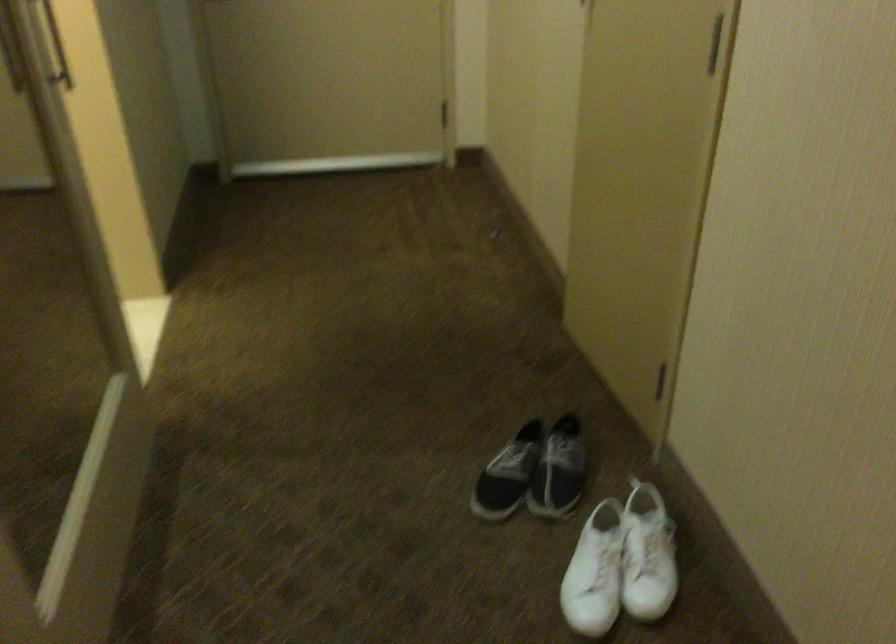
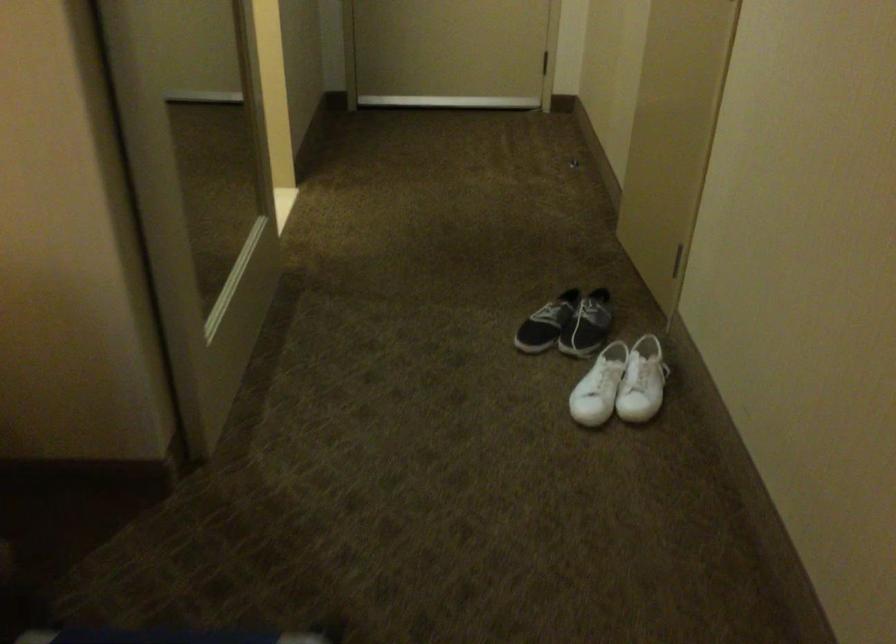
In the second image, find the point that corresponds to point (533, 471) in the first image.

(567, 324)